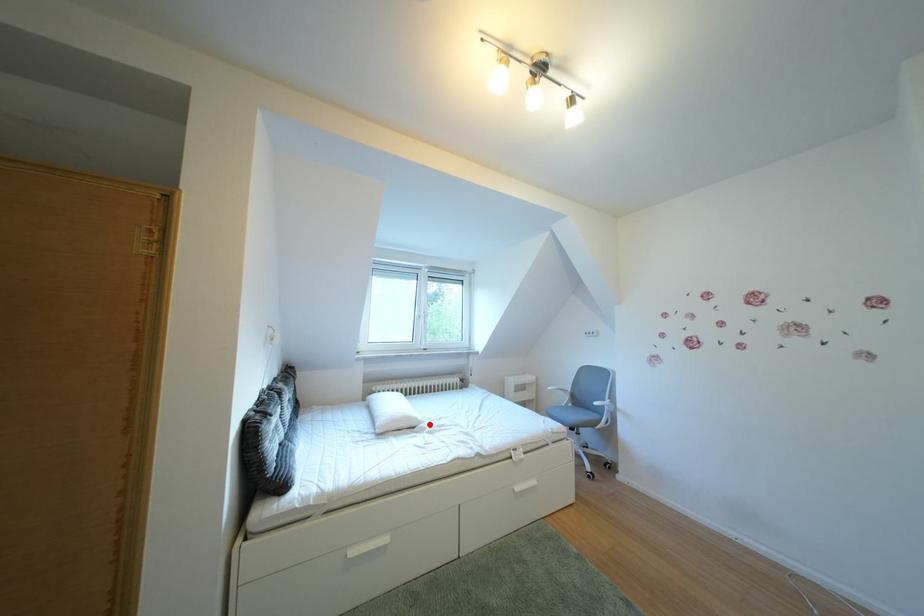
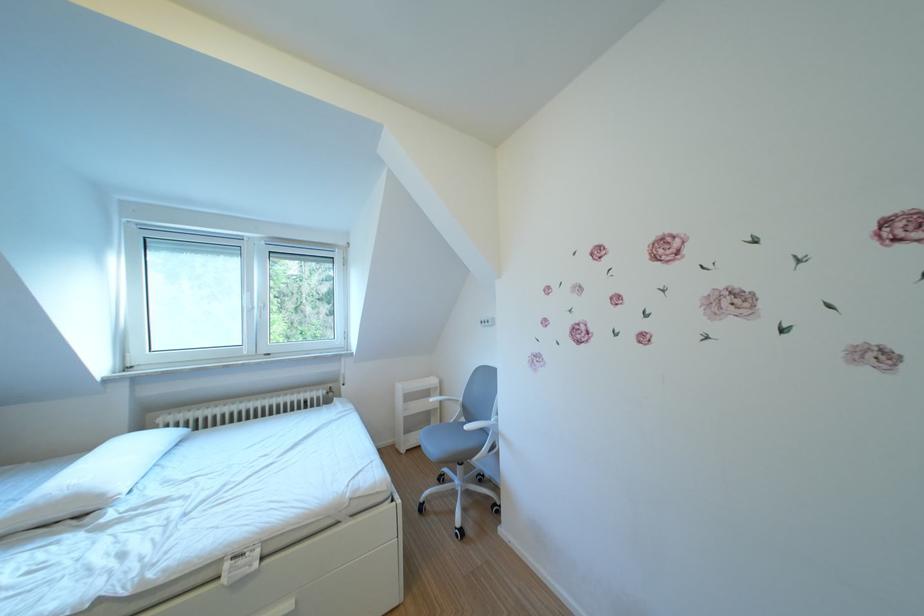
Where in the second image is the point corresponding to the highlighted location from the first image?

(115, 501)